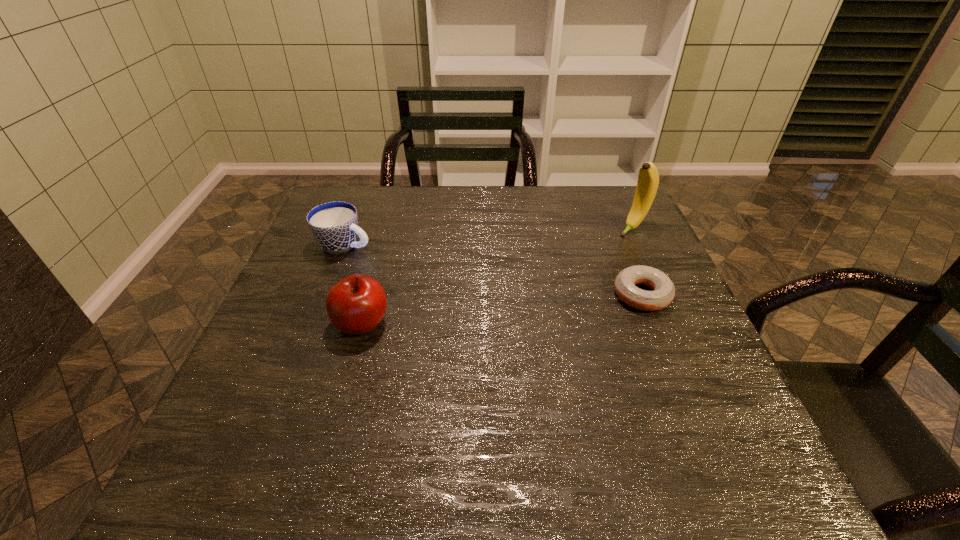
Identify the location of free spot on the desktop that is between the third shortest object and the shortest object and is positioned from the stem of the banana. (536, 306).

The image size is (960, 540). Find the location of `free spot on the desktop that is between the apple and the doughnut and is positioned on the side of the cup with the handle`. free spot on the desktop that is between the apple and the doughnut and is positioned on the side of the cup with the handle is located at coordinates (537, 306).